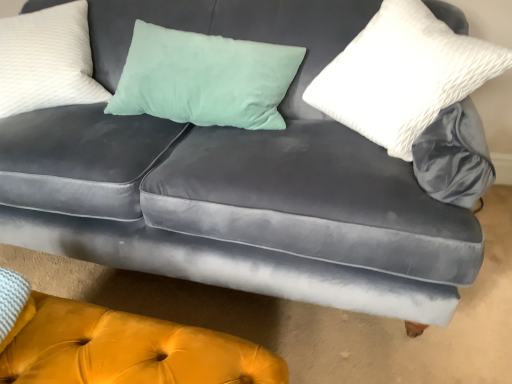
Question: Is white textured pillow at upper left, positioned as the 1th pillow in left-to-right order, to the right of velvet yellow ottoman at lower center from the viewer's perspective?

Choices:
 (A) yes
 (B) no

Answer: (B)

Question: Does white textured pillow at upper left, the second pillow from the right, have a lesser height compared to velvet yellow ottoman at lower center?

Choices:
 (A) yes
 (B) no

Answer: (B)

Question: Is white textured pillow at upper left, the second pillow from the right, in front of velvet yellow ottoman at lower center?

Choices:
 (A) no
 (B) yes

Answer: (A)

Question: Would you consider white textured pillow at upper left, the second pillow from the right, to be distant from velvet yellow ottoman at lower center?

Choices:
 (A) yes
 (B) no

Answer: (B)

Question: Considering the relative sizes of white textured pillow at upper left, positioned as the 1th pillow in left-to-right order, and velvet yellow ottoman at lower center in the image provided, is white textured pillow at upper left, positioned as the 1th pillow in left-to-right order, bigger than velvet yellow ottoman at lower center?

Choices:
 (A) yes
 (B) no

Answer: (A)

Question: Is white textured pillow at upper left, the second pillow from the right, at the left side of velvet yellow ottoman at lower center?

Choices:
 (A) yes
 (B) no

Answer: (A)

Question: From a real-world perspective, is white textured pillow at upper left, positioned as the 1th pillow in left-to-right order, positioned over white textured pillow at upper right, positioned as the 2th pillow in left-to-right order, based on gravity?

Choices:
 (A) yes
 (B) no

Answer: (B)

Question: Is white textured pillow at upper left, positioned as the 1th pillow in left-to-right order, further to the viewer compared to white textured pillow at upper right, arranged as the 1th pillow when viewed from the right?

Choices:
 (A) no
 (B) yes

Answer: (B)

Question: Is white textured pillow at upper left, positioned as the 1th pillow in left-to-right order, shorter than white textured pillow at upper right, arranged as the 1th pillow when viewed from the right?

Choices:
 (A) no
 (B) yes

Answer: (B)

Question: Is white textured pillow at upper left, the second pillow from the right, taller than white textured pillow at upper right, arranged as the 1th pillow when viewed from the right?

Choices:
 (A) yes
 (B) no

Answer: (B)

Question: Does white textured pillow at upper left, positioned as the 1th pillow in left-to-right order, have a greater width compared to white textured pillow at upper right, arranged as the 1th pillow when viewed from the right?

Choices:
 (A) yes
 (B) no

Answer: (A)

Question: Does white textured pillow at upper left, positioned as the 1th pillow in left-to-right order, have a lesser width compared to white textured pillow at upper right, arranged as the 1th pillow when viewed from the right?

Choices:
 (A) no
 (B) yes

Answer: (A)

Question: Can you confirm if white textured pillow at upper right, arranged as the 1th pillow when viewed from the right, is taller than white textured pillow at upper left, positioned as the 1th pillow in left-to-right order?

Choices:
 (A) yes
 (B) no

Answer: (A)